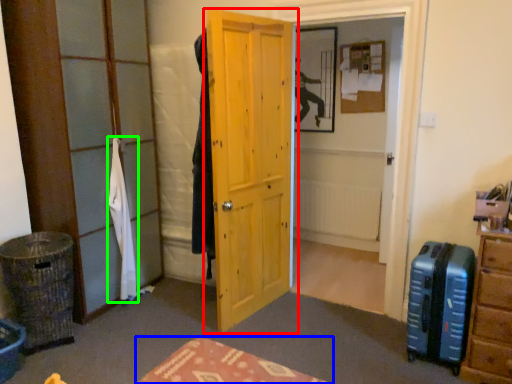
Question: Estimate the real-world distances between objects in this image. Which object is closer to door (highlighted by a red box), furniture (highlighted by a blue box) or clothing (highlighted by a green box)?

Choices:
 (A) furniture
 (B) clothing

Answer: (B)